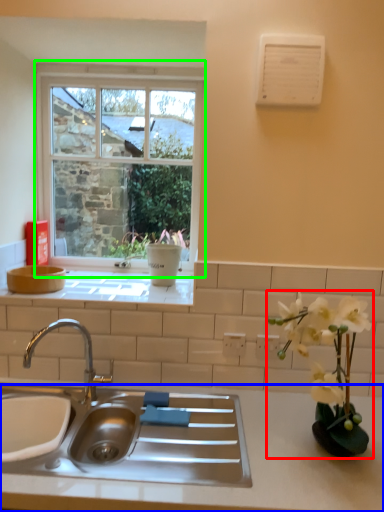
Question: Estimate the real-world distances between objects in this image. Which object is farther from houseplant (highlighted by a red box), countertop (highlighted by a blue box) or window (highlighted by a green box)?

Choices:
 (A) countertop
 (B) window

Answer: (B)